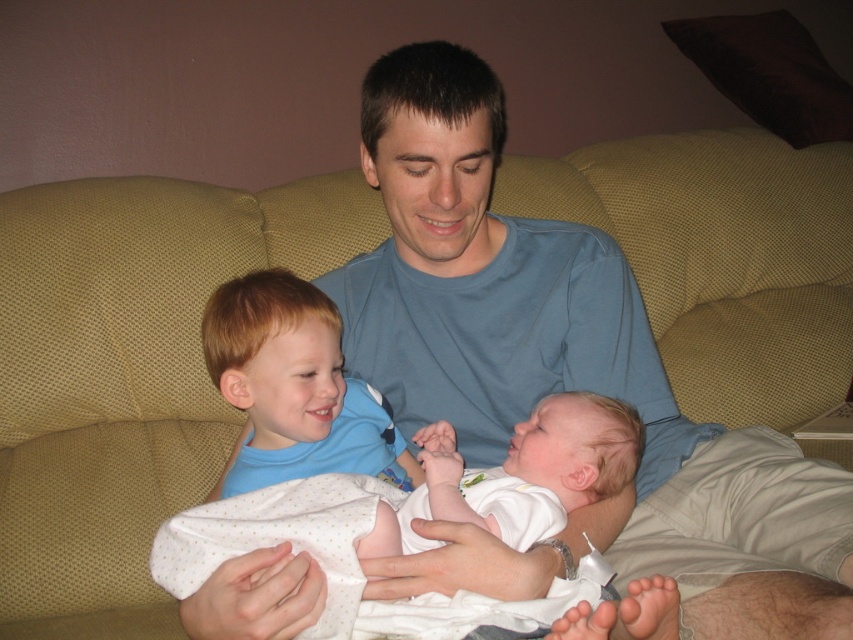
Question: Does white soft fabric baby at center appear under blue cotton shirt at center?

Choices:
 (A) yes
 (B) no

Answer: (A)

Question: Is white soft fabric baby at center closer to camera compared to blue cotton shirt at center?

Choices:
 (A) yes
 (B) no

Answer: (A)

Question: Which point is closer to the camera?

Choices:
 (A) blue cotton shirt at center
 (B) white soft fabric baby at center

Answer: (B)

Question: Is white soft fabric baby at center bigger than blue cotton shirt at center?

Choices:
 (A) no
 (B) yes

Answer: (B)

Question: Which of the following is the closest to the observer?

Choices:
 (A) white soft fabric baby at center
 (B) blue cotton shirt at center

Answer: (A)

Question: Which object is closer to the camera taking this photo?

Choices:
 (A) white soft fabric baby at center
 (B) blue cotton shirt at center

Answer: (A)